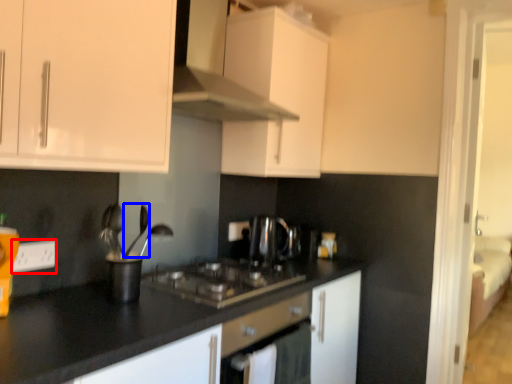
Question: Which object appears farthest to the camera in this image, electric outlet (highlighted by a red box) or silverware (highlighted by a blue box)?

Choices:
 (A) electric outlet
 (B) silverware

Answer: (B)